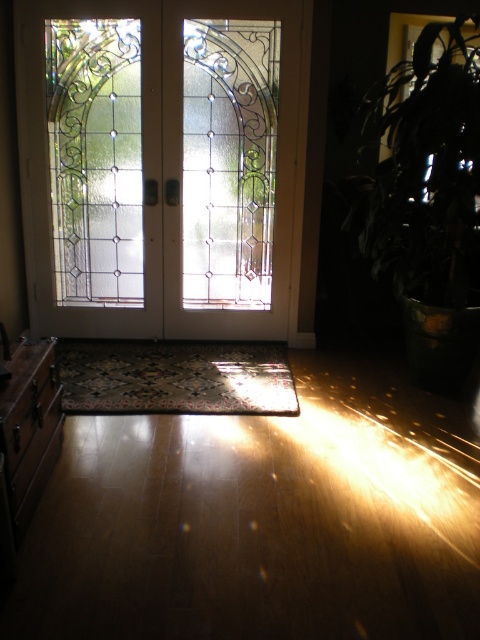
Looking at this image, is clear glass doors at center below dark green leafy plant at right?

Incorrect, clear glass doors at center is not positioned below dark green leafy plant at right.

Can you confirm if clear glass doors at center is thinner than dark green leafy plant at right?

No, clear glass doors at center is not thinner than dark green leafy plant at right.

Is point (252, 99) positioned in front of point (459, 52)?

Yes, point (252, 99) is closer to viewer.

Find the location of a particular element. Image resolution: width=480 pixels, height=640 pixels. clear glass doors at center is located at coordinates (163, 164).

Between point (115, 182) and point (218, 364), which one is positioned in front?

Point (218, 364) is in front.

What do you see at coordinates (163, 164) in the screenshot? I see `clear glass doors at center` at bounding box center [163, 164].

Which is behind, point (145, 168) or point (177, 364)?

Positioned behind is point (145, 168).

I want to click on clear glass doors at center, so click(x=163, y=164).

Which is behind, point (445, 176) or point (124, 378)?

The point (124, 378) is behind.

Is dark green leafy plant at right above carpeted mat at center?

Yes, dark green leafy plant at right is above carpeted mat at center.

Does point (450, 28) come farther from viewer compared to point (213, 378)?

No, it is in front of (213, 378).

Where is `dark green leafy plant at right`? dark green leafy plant at right is located at coordinates (428, 168).